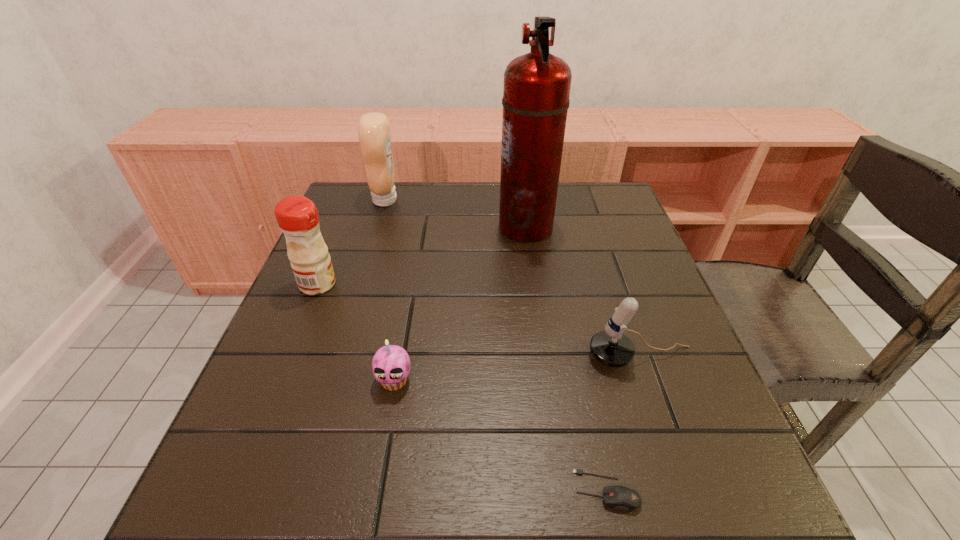
You are a GUI agent. You are given a task and a screenshot of the screen. Output one action in this format:
    pyautogui.click(x=<x>, y=<y>)
    Task: Click on the object at the near edge
    The image size is (960, 540).
    Given the screenshot: What is the action you would take?
    pyautogui.click(x=622, y=498)

Where is `object located at the right edge`? This screenshot has width=960, height=540. object located at the right edge is located at coordinates (611, 347).

Locate an element on the screen. The height and width of the screenshot is (540, 960). object that is at the far left corner is located at coordinates (374, 131).

Locate an element on the screen. The height and width of the screenshot is (540, 960). free space at the far edge of the desktop is located at coordinates (471, 197).

In order to click on vacant space at the near edge of the desktop in this screenshot , I will do `click(381, 503)`.

Where is `free space at the left edge of the desktop`? This screenshot has width=960, height=540. free space at the left edge of the desktop is located at coordinates (340, 329).

In the image, there is a desktop. In order to click on free region at the right edge in this screenshot , I will do `click(668, 461)`.

This screenshot has height=540, width=960. In order to click on free point at the far left corner in this screenshot , I will do `click(366, 193)`.

The height and width of the screenshot is (540, 960). Identify the location of vacant space at the near left corner. (252, 529).

I want to click on free space at the far right corner of the desktop, so click(629, 213).